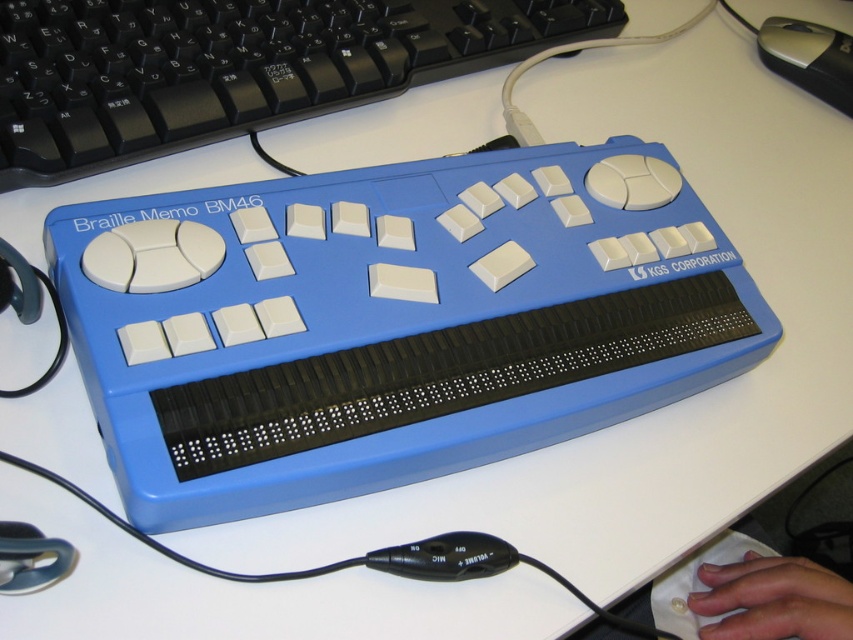
Between blue plastic keyboard at upper center and silver metallic mouse at upper right, which one appears on the left side from the viewer's perspective?

Positioned to the left is blue plastic keyboard at upper center.

Can you confirm if blue plastic keyboard at upper center is positioned below silver metallic mouse at upper right?

Correct, blue plastic keyboard at upper center is located below silver metallic mouse at upper right.

Who is more distant from viewer, (299, 118) or (817, 52)?

Point (817, 52)

This screenshot has height=640, width=853. I want to click on blue plastic keyboard at upper center, so click(236, 67).